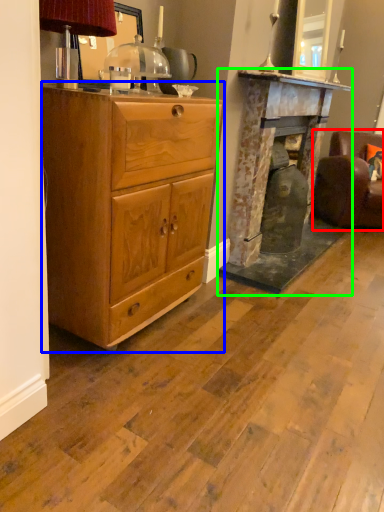
Question: Which object is positioned farthest from swivel chair (highlighted by a red box)? Select from chest of drawers (highlighted by a blue box) and fireplace (highlighted by a green box).

Choices:
 (A) chest of drawers
 (B) fireplace

Answer: (A)